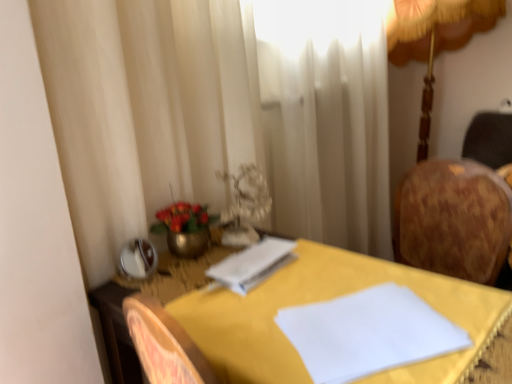
Question: Does yellow fabric-covered table at center have a lesser height compared to white paper at center?

Choices:
 (A) yes
 (B) no

Answer: (B)

Question: Is yellow fabric-covered table at center smaller than white paper at center?

Choices:
 (A) no
 (B) yes

Answer: (A)

Question: Is yellow fabric-covered table at center in contact with white paper at center?

Choices:
 (A) no
 (B) yes

Answer: (A)

Question: Is yellow fabric-covered table at center oriented towards white paper at center?

Choices:
 (A) yes
 (B) no

Answer: (B)

Question: Does yellow fabric-covered table at center lie behind white paper at center?

Choices:
 (A) yes
 (B) no

Answer: (B)

Question: In the image, is gold fabric lampshade at upper right positioned in front of or behind yellow fabric-covered table at center?

Choices:
 (A) behind
 (B) front

Answer: (A)

Question: From the image's perspective, is gold fabric lampshade at upper right located above or below yellow fabric-covered table at center?

Choices:
 (A) below
 (B) above

Answer: (B)

Question: Is gold fabric lampshade at upper right situated inside yellow fabric-covered table at center or outside?

Choices:
 (A) inside
 (B) outside

Answer: (B)

Question: From a real-world perspective, is gold fabric lampshade at upper right physically located above or below yellow fabric-covered table at center?

Choices:
 (A) above
 (B) below

Answer: (A)

Question: Looking at their shapes, would you say metallic gold vase at center is wider or thinner than gold fabric lampshade at upper right?

Choices:
 (A) wide
 (B) thin

Answer: (B)

Question: From a real-world perspective, is metallic gold vase at center positioned above or below gold fabric lampshade at upper right?

Choices:
 (A) below
 (B) above

Answer: (A)

Question: Looking at the image, does metallic gold vase at center seem bigger or smaller compared to gold fabric lampshade at upper right?

Choices:
 (A) big
 (B) small

Answer: (B)

Question: In the image, is metallic gold vase at center on the left side or the right side of gold fabric lampshade at upper right?

Choices:
 (A) left
 (B) right

Answer: (A)

Question: Is white paper at center in front of or behind metallic gold vase at center in the image?

Choices:
 (A) behind
 (B) front

Answer: (B)

Question: Would you say white paper at center is inside or outside metallic gold vase at center?

Choices:
 (A) inside
 (B) outside

Answer: (B)